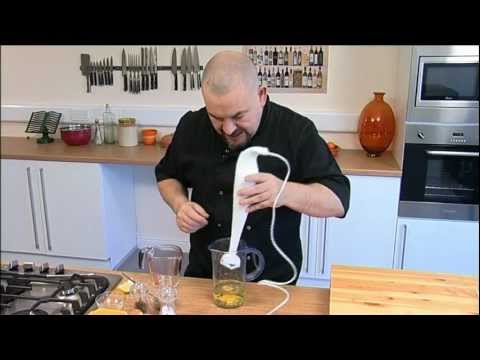
Image resolution: width=480 pixels, height=360 pixels. I want to click on knives, so click(440, 169), click(146, 73), click(197, 68), click(78, 75).